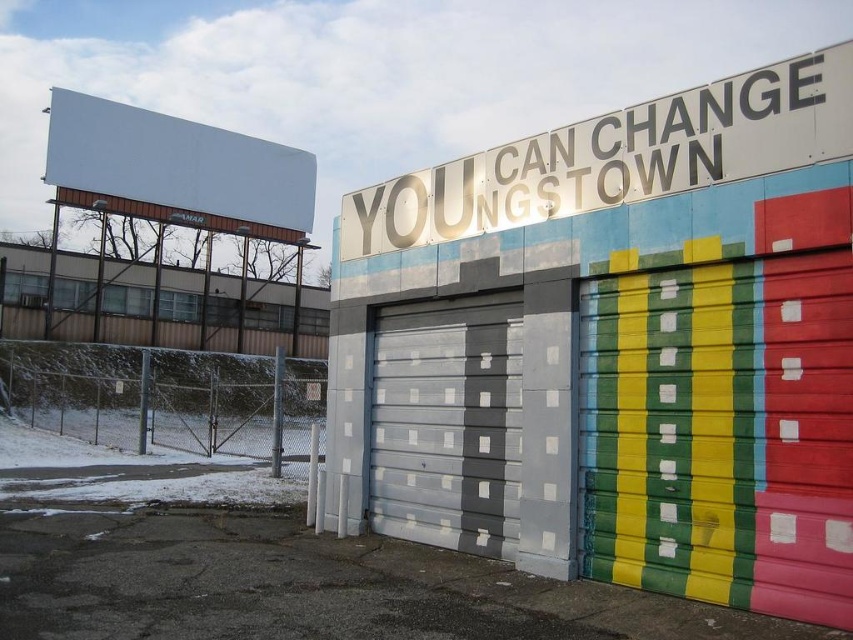
Question: Does metallic silver sign at upper center have a greater width compared to gray matte garage door at center?

Choices:
 (A) yes
 (B) no

Answer: (A)

Question: Which point is closer to the camera?

Choices:
 (A) (403, 337)
 (B) (792, 100)

Answer: (B)

Question: Which object is closer to the camera taking this photo?

Choices:
 (A) metallic silver sign at upper center
 (B) gray matte garage door at center

Answer: (A)

Question: Is metallic silver sign at upper center above gray matte garage door at center?

Choices:
 (A) no
 (B) yes

Answer: (B)

Question: Where is metallic silver sign at upper center located in relation to gray matte garage door at center in the image?

Choices:
 (A) above
 (B) below

Answer: (A)